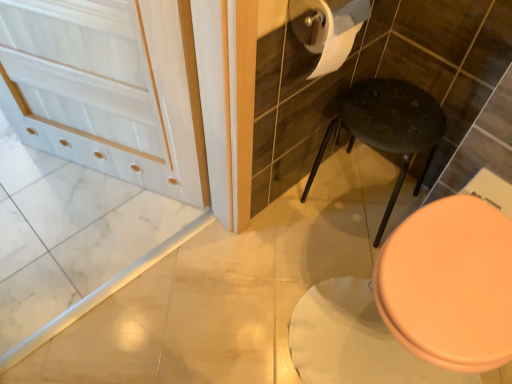
Locate an element on the screen. This screenshot has width=512, height=384. free space below dark speckled plastic stool at center (from a real-world perspective) is located at coordinates (351, 203).